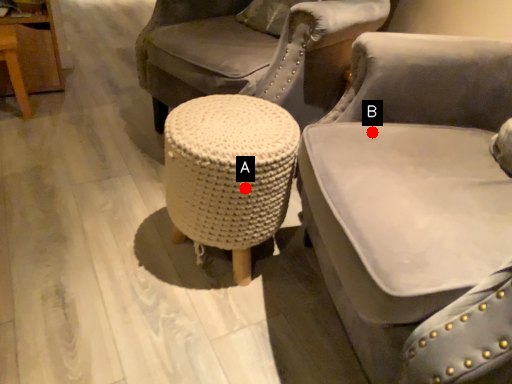
Question: Two points are circled on the image, labeled by A and B beside each circle. Which point appears closest to the camera in this image?

Choices:
 (A) A is closer
 (B) B is closer

Answer: (B)